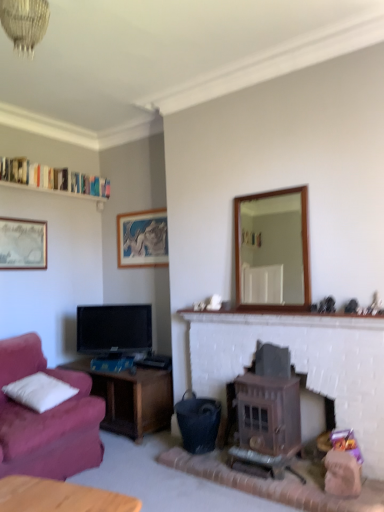
Question: From the image's perspective, is white fluffy pillow at left located above crystal glass chandelier at upper center?

Choices:
 (A) no
 (B) yes

Answer: (A)

Question: Is white fluffy pillow at left far away from crystal glass chandelier at upper center?

Choices:
 (A) no
 (B) yes

Answer: (B)

Question: Does white fluffy pillow at left come behind crystal glass chandelier at upper center?

Choices:
 (A) yes
 (B) no

Answer: (A)

Question: Considering the relative sizes of white fluffy pillow at left and crystal glass chandelier at upper center in the image provided, is white fluffy pillow at left shorter than crystal glass chandelier at upper center?

Choices:
 (A) no
 (B) yes

Answer: (B)

Question: Does white fluffy pillow at left touch crystal glass chandelier at upper center?

Choices:
 (A) no
 (B) yes

Answer: (A)

Question: From the image's perspective, is wooden stove at center above or below matte silver picture frame at upper left, the first picture frame in the front-to-back sequence?

Choices:
 (A) below
 (B) above

Answer: (A)

Question: Considering the relative positions of wooden stove at center and matte silver picture frame at upper left, which ranks as the 2th picture frame in back-to-front order, in the image provided, is wooden stove at center to the left or to the right of matte silver picture frame at upper left, which ranks as the 2th picture frame in back-to-front order,?

Choices:
 (A) right
 (B) left

Answer: (A)

Question: Is point (231, 327) positioned closer to the camera than point (34, 245)?

Choices:
 (A) farther
 (B) closer

Answer: (B)

Question: Considering their positions, is wooden stove at center located in front of or behind matte silver picture frame at upper left, which ranks as the 2th picture frame in back-to-front order?

Choices:
 (A) behind
 (B) front

Answer: (B)

Question: From a real-world perspective, is white fluffy pillow at left physically located above or below wooden stove at center?

Choices:
 (A) below
 (B) above

Answer: (B)

Question: Considering their positions, is white fluffy pillow at left located in front of or behind wooden stove at center?

Choices:
 (A) behind
 (B) front

Answer: (A)

Question: Is white fluffy pillow at left inside or outside of wooden stove at center?

Choices:
 (A) outside
 (B) inside

Answer: (A)

Question: Is white fluffy pillow at left taller or shorter than wooden stove at center?

Choices:
 (A) tall
 (B) short

Answer: (B)

Question: Looking at their shapes, would you say crystal glass chandelier at upper center is wider or thinner than matte black tv at left?

Choices:
 (A) thin
 (B) wide

Answer: (B)

Question: From a real-world perspective, relative to matte black tv at left, is crystal glass chandelier at upper center vertically above or below?

Choices:
 (A) below
 (B) above

Answer: (B)